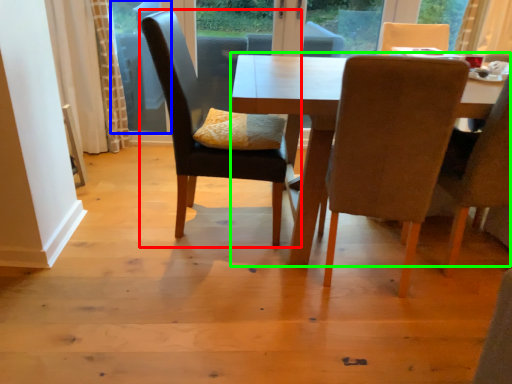
Question: Which object is the closest to the chair (highlighted by a red box)? Choose among these: window screen (highlighted by a blue box) or kitchen & dining room table (highlighted by a green box).

Choices:
 (A) window screen
 (B) kitchen & dining room table

Answer: (B)